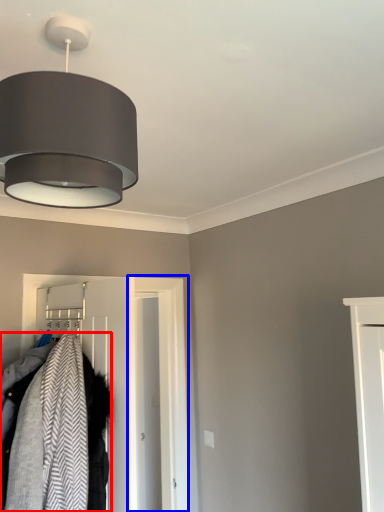
Question: Among these objects, which one is nearest to the camera, laundry (highlighted by a red box) or door (highlighted by a blue box)?

Choices:
 (A) laundry
 (B) door

Answer: (A)